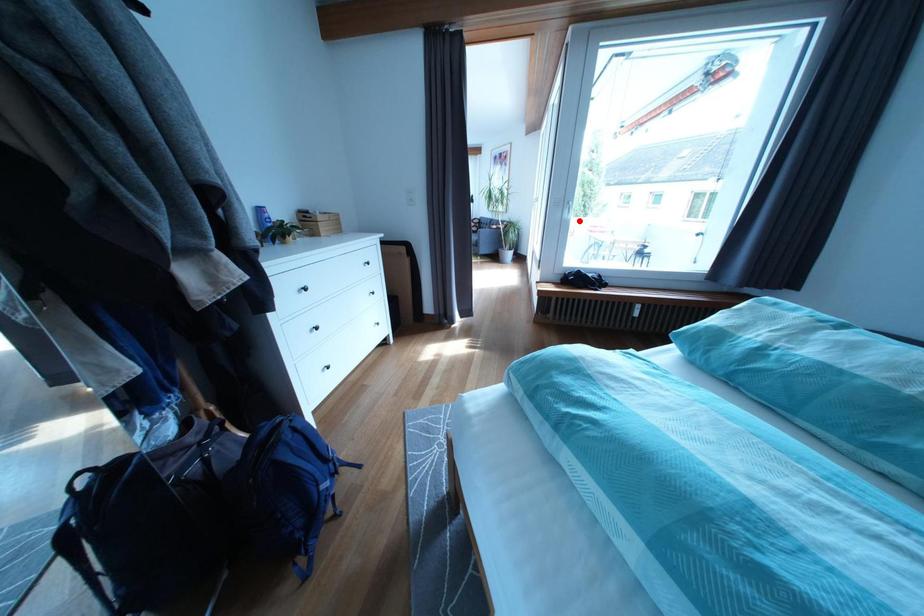
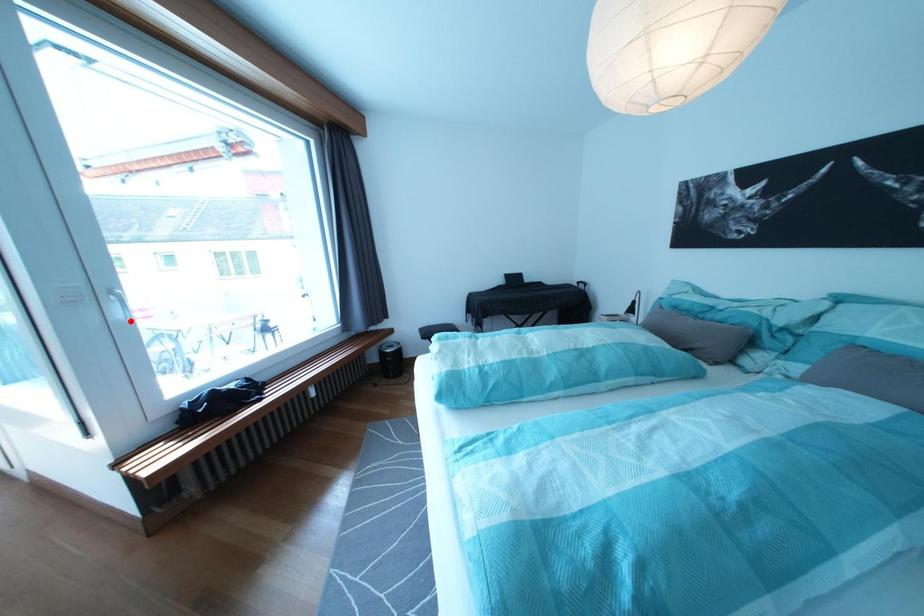
I am providing you with two images of the same scene from different viewpoints. A red point is marked on the first image and another point is marked on the second image. Is the red point in image1 aligned with the point shown in image2?

Yes